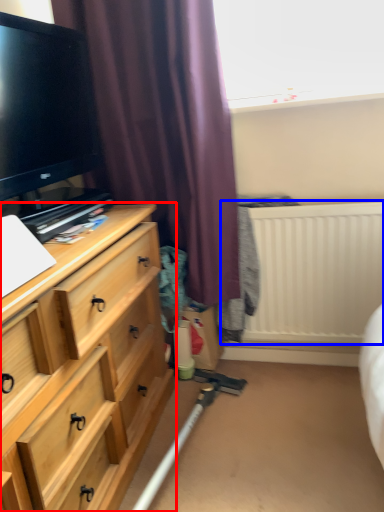
Question: Which object is further to the camera taking this photo, chest of drawers (highlighted by a red box) or radiator (highlighted by a blue box)?

Choices:
 (A) chest of drawers
 (B) radiator

Answer: (B)